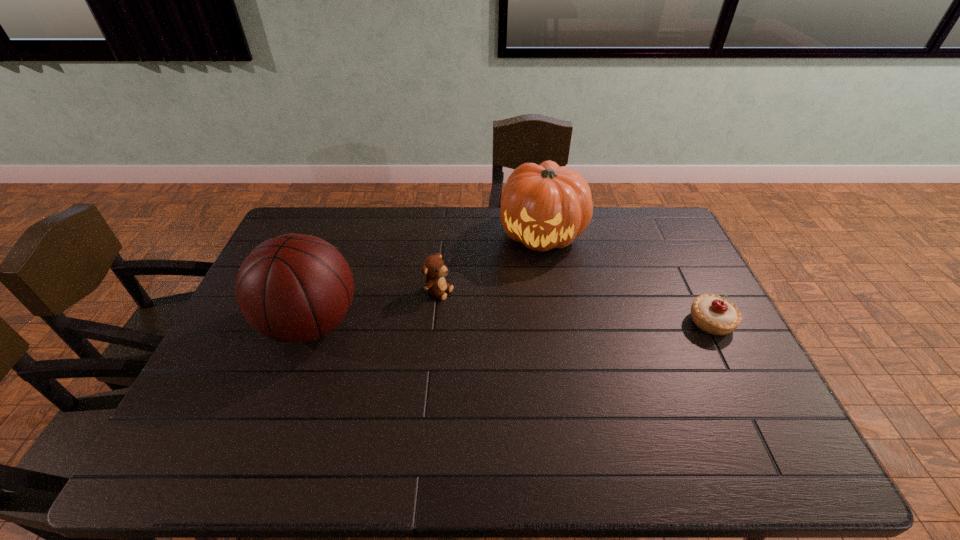
Where is `free region at the left edge of the desktop`? The width and height of the screenshot is (960, 540). free region at the left edge of the desktop is located at coordinates (262, 379).

The height and width of the screenshot is (540, 960). In the image, there is a desktop. Identify the location of vacant space at the right edge. (689, 306).

Identify the location of vacant space at the near right corner of the desktop. (756, 392).

Locate an element on the screen. free spot between the shortest object and the second object from right to left is located at coordinates pos(627,278).

You are a GUI agent. You are given a task and a screenshot of the screen. Output one action in this format:
    pyautogui.click(x=<x>, y=<y>)
    Task: Click on the vacant area that lies between the farthest object and the pastry
    
    Given the screenshot: What is the action you would take?
    pyautogui.click(x=627, y=278)

This screenshot has width=960, height=540. I want to click on free space between the basketball and the shortest object, so click(511, 323).

Find the location of `free space between the third tallest object and the leftmost object`. free space between the third tallest object and the leftmost object is located at coordinates (375, 307).

I want to click on free point between the leftmost object and the pastry, so click(511, 323).

Identify the location of free space that is in between the third tallest object and the pastry. (575, 306).

Where is `unoccupied position between the teddy bear and the leftmost object`? The image size is (960, 540). unoccupied position between the teddy bear and the leftmost object is located at coordinates (375, 307).